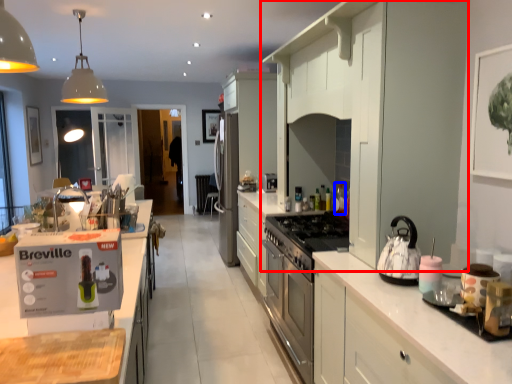
Question: Which object is closer to the camera taking this photo, cabinetry (highlighted by a red box) or bottle (highlighted by a blue box)?

Choices:
 (A) cabinetry
 (B) bottle

Answer: (A)